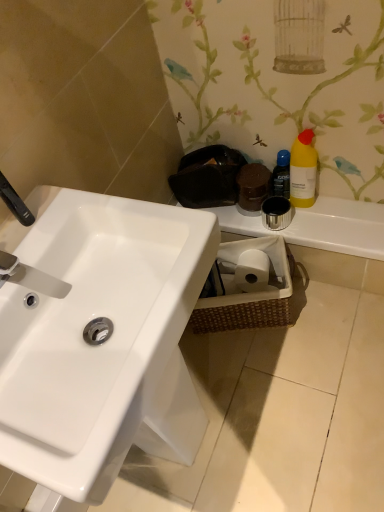
This screenshot has height=512, width=384. Find the location of `empty space that is to the right of white glossy sink at center`. empty space that is to the right of white glossy sink at center is located at coordinates (303, 401).